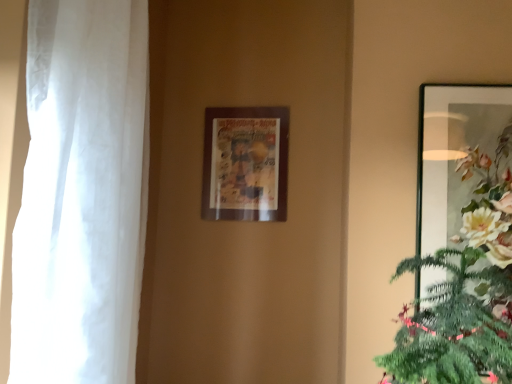
Question: Is metallic silver picture frame at right, which appears as the second picture frame when viewed from the left, in front of or behind wooden picture frame at center, which is the 2th picture frame from front to back, in the image?

Choices:
 (A) behind
 (B) front

Answer: (B)

Question: Looking at the image, does metallic silver picture frame at right, the second picture frame from the back, seem bigger or smaller compared to wooden picture frame at center, which is the 2th picture frame from front to back?

Choices:
 (A) small
 (B) big

Answer: (B)

Question: Estimate the real-world distances between objects in this image. Which object is farther from the metallic silver picture frame at right, which appears as the second picture frame when viewed from the left?

Choices:
 (A) white sheer curtain at left
 (B) wooden picture frame at center, the 1th picture frame when ordered from left to right

Answer: (A)

Question: Which is nearer to the white sheer curtain at left?

Choices:
 (A) wooden picture frame at center, which is the 2th picture frame from right to left
 (B) metallic silver picture frame at right, which ranks as the 1th picture frame in front-to-back order

Answer: (A)